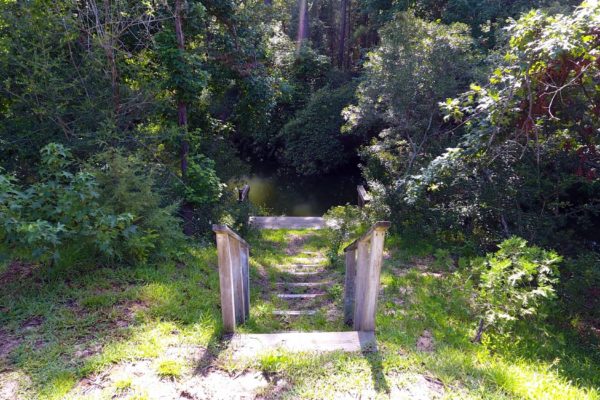
You are a GUI agent. You are given a task and a screenshot of the screen. Output one action in this format:
    pyautogui.click(x=<x>, y=<y>)
    Task: Click on the 1 bottom stair
    
    Given the screenshot: What is the action you would take?
    pyautogui.click(x=279, y=227)